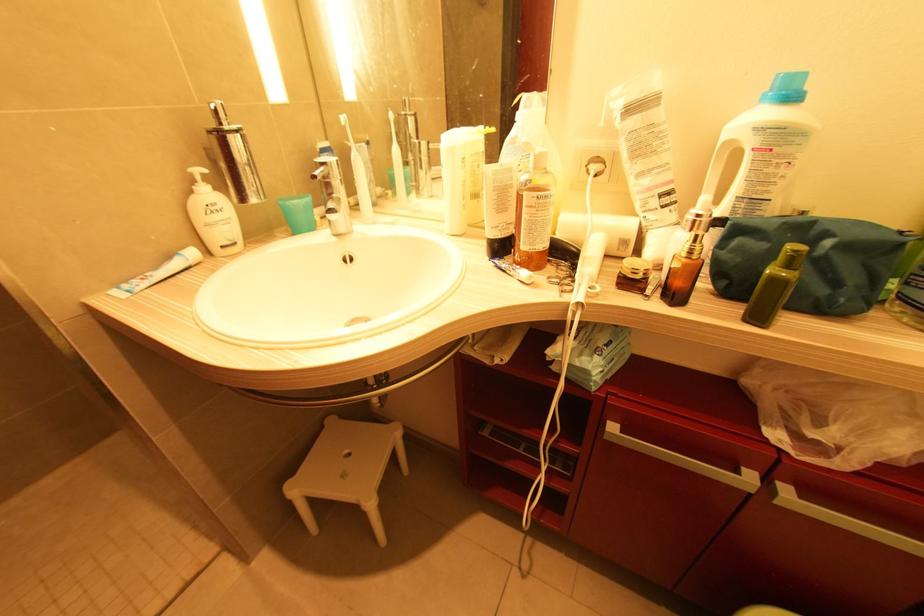
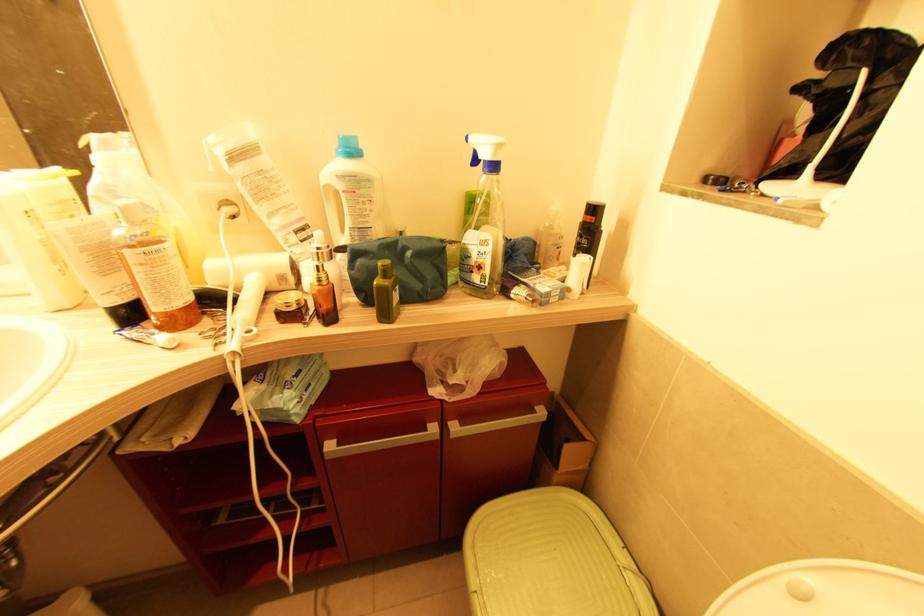
Locate, in the second image, the point that corresponds to (x=625, y=244) in the first image.

(284, 278)